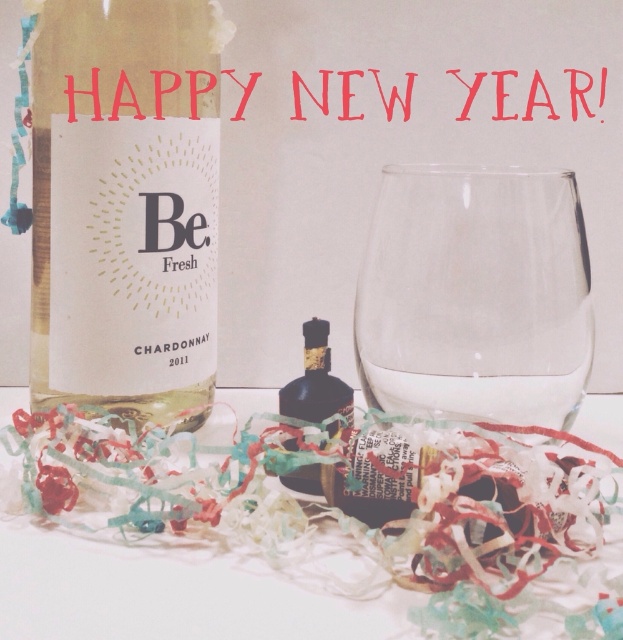
You are standing in front of the festive New Year scene with the Be Fresh Chardonnay 2011 wine bottle and an empty wine glass. You want to place a new wine glass between the two points marked as point (105, 397) and point (326, 356). Which point should the new glass be closer to so it stays in front of both the wine bottle and the existing glass?

The new wine glass should be placed closer to point (326, 356) because point (105, 397) is behind point (326, 356). Placing it near the front point ensures it stays in front of both the wine bottle and the existing glass.

You are organizing a New Year party and need to place a decorative item between the white paper at center and the shiny dark glass bottle at center. Since you want it to be visible to guests, which object should you place it closer to?

You should place the decorative item closer to the white paper at center because it is closer to the viewer than the shiny dark glass bottle at center, making it more visible.

You are a bartender preparing a drink and need to place the white matte bottle at left and the transparent glass at center on a shelf. The shelf has a width of 4 inches. Can both items fit side by side without overlapping?

The white matte bottle at left and transparent glass at center are 4.13 inches apart, so they cannot fit on a 4 inch shelf without overlapping since the total width required is greater than the shelf space available.